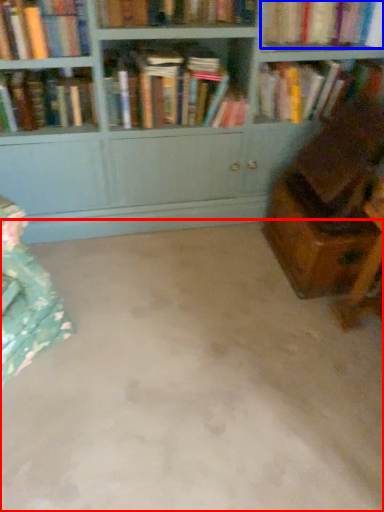
Question: Among these objects, which one is farthest to the camera, concrete (highlighted by a red box) or book (highlighted by a blue box)?

Choices:
 (A) concrete
 (B) book

Answer: (B)